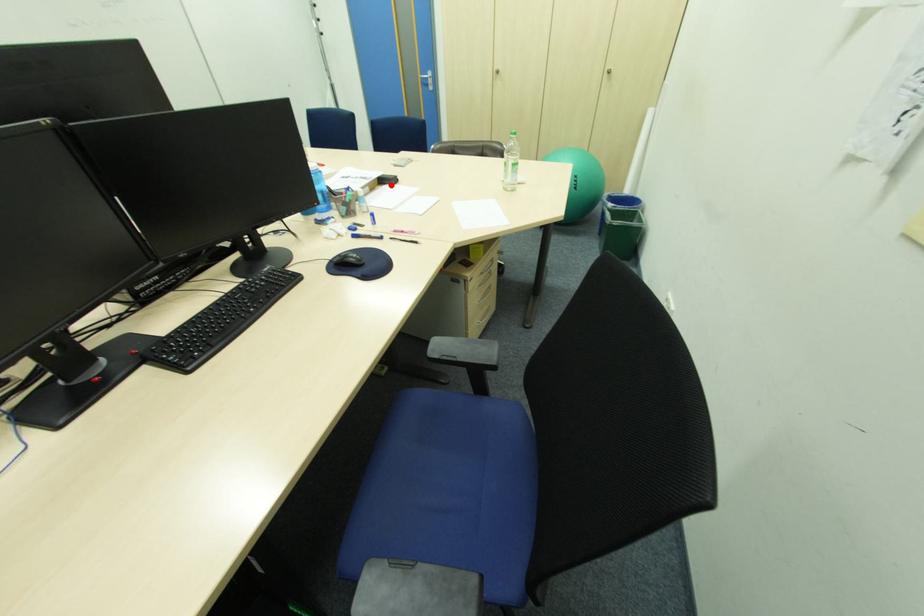
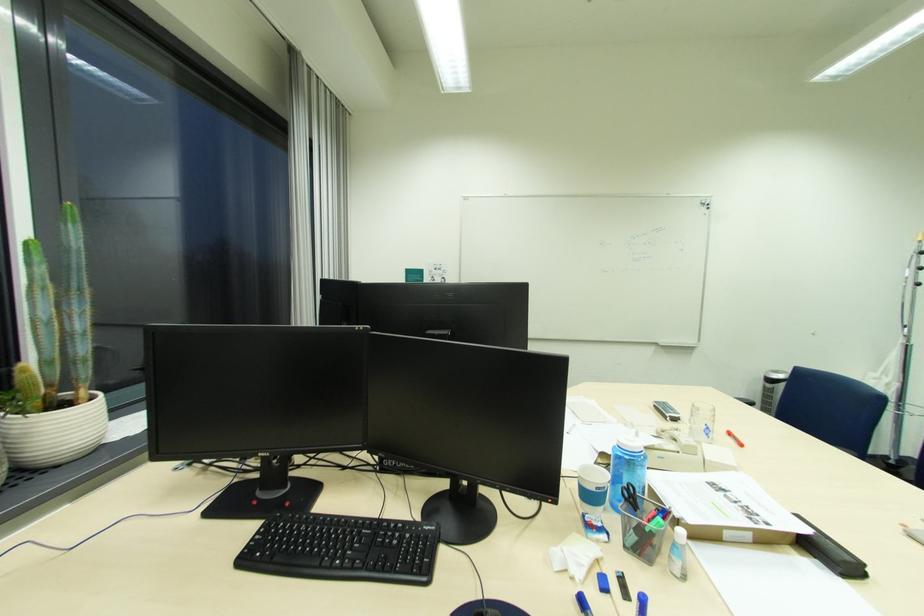
Find the pixel in the second image that matches the highlighted location in the first image.

(821, 557)